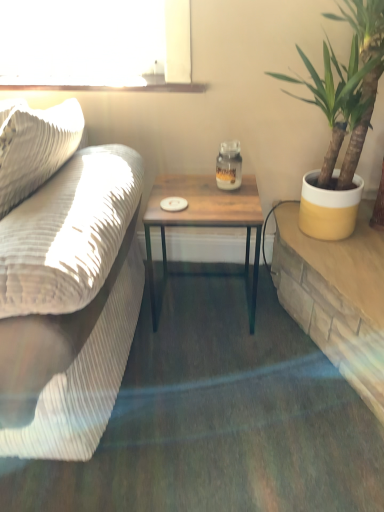
Question: Considering the relative sizes of wooden table at center and yellow ceramic pot at right in the image provided, is wooden table at center smaller than yellow ceramic pot at right?

Choices:
 (A) no
 (B) yes

Answer: (B)

Question: Can you confirm if wooden table at center is positioned to the right of yellow ceramic pot at right?

Choices:
 (A) no
 (B) yes

Answer: (A)

Question: Can we say wooden table at center lies outside yellow ceramic pot at right?

Choices:
 (A) yes
 (B) no

Answer: (A)

Question: Is wooden table at center taller than yellow ceramic pot at right?

Choices:
 (A) no
 (B) yes

Answer: (A)

Question: From a real-world perspective, is wooden table at center physically below yellow ceramic pot at right?

Choices:
 (A) no
 (B) yes

Answer: (B)

Question: Does point (304, 297) appear closer or farther from the camera than point (228, 159)?

Choices:
 (A) closer
 (B) farther

Answer: (B)

Question: Would you say wooden table at right is inside or outside matte glass jar at center?

Choices:
 (A) outside
 (B) inside

Answer: (A)

Question: Considering the positions of wooden table at right and matte glass jar at center in the image, is wooden table at right wider or thinner than matte glass jar at center?

Choices:
 (A) wide
 (B) thin

Answer: (A)

Question: From their relative heights in the image, would you say wooden table at right is taller or shorter than matte glass jar at center?

Choices:
 (A) tall
 (B) short

Answer: (A)

Question: From a real-world perspective, is yellow ceramic pot at right physically located above or below matte glass jar at center?

Choices:
 (A) below
 (B) above

Answer: (B)

Question: From the image's perspective, is yellow ceramic pot at right positioned above or below matte glass jar at center?

Choices:
 (A) below
 (B) above

Answer: (B)

Question: Looking at their shapes, would you say yellow ceramic pot at right is wider or thinner than matte glass jar at center?

Choices:
 (A) thin
 (B) wide

Answer: (B)

Question: Which is correct: yellow ceramic pot at right is inside matte glass jar at center, or outside of it?

Choices:
 (A) outside
 (B) inside

Answer: (A)

Question: Considering their positions, is yellow ceramic pot at right located in front of or behind clear glass window sill at upper center?

Choices:
 (A) behind
 (B) front

Answer: (B)

Question: From a real-world perspective, relative to clear glass window sill at upper center, is yellow ceramic pot at right vertically above or below?

Choices:
 (A) below
 (B) above

Answer: (A)